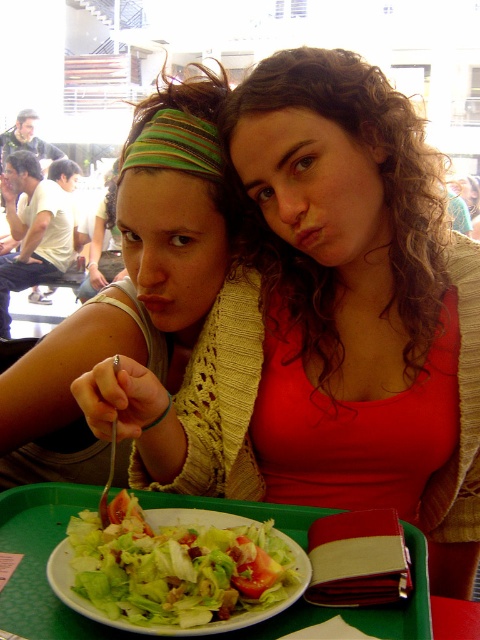
Which is behind, point (97, 568) or point (427, 582)?

The point (427, 582) is behind.

Is green leafy salad at center to the right of green plastic tray at center from the viewer's perspective?

Result: Correct, you'll find green leafy salad at center to the right of green plastic tray at center.

Is point (287, 552) more distant than point (369, 612)?

Yes, it is behind point (369, 612).

Where is `green leafy salad at center`? green leafy salad at center is located at coordinates (178, 566).

Does point (316, 300) lie in front of point (425, 572)?

That is False.

Does matte yellow scarf at center come behind green plastic tray at center?

Yes, matte yellow scarf at center is behind green plastic tray at center.

Does point (252, 464) come in front of point (307, 624)?

No, it is behind (307, 624).

Find the location of a particular element. Image resolution: width=480 pixels, height=640 pixels. matte yellow scarf at center is located at coordinates (325, 321).

Measure the distance between matte green headband at center and camera.

matte green headband at center and camera are 91.98 centimeters apart.

Based on the photo, between matte green headband at center and green plastic tray at center, which one is positioned lower?

green plastic tray at center is below.

Is point (192, 186) closer to camera compared to point (149, 502)?

That is False.

This screenshot has width=480, height=640. Identify the location of matte green headband at center. (132, 285).